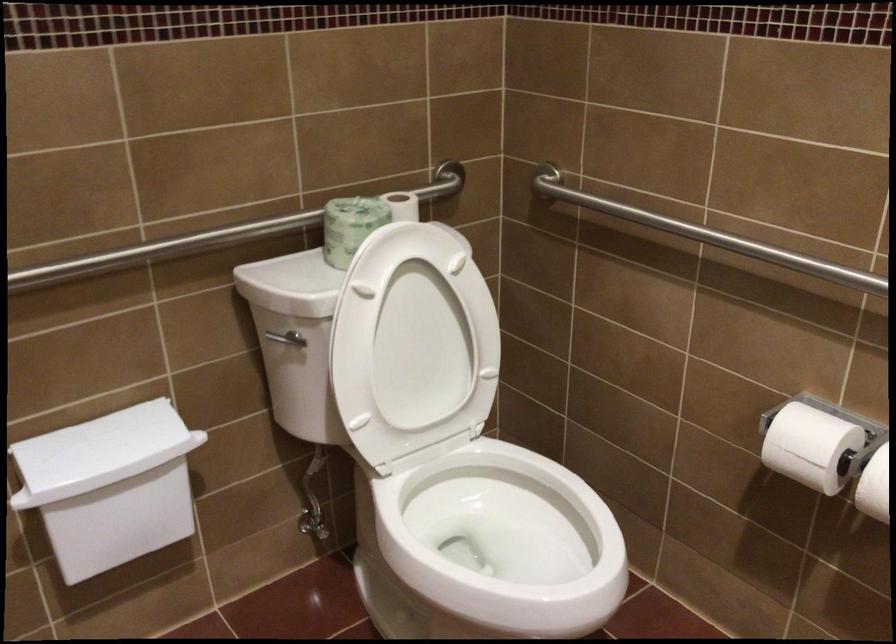
Question: The first image is from the beginning of the video and the second image is from the end. How did the camera likely rotate when shooting the video?

Choices:
 (A) Left
 (B) Right
 (C) Up
 (D) Down

Answer: (A)